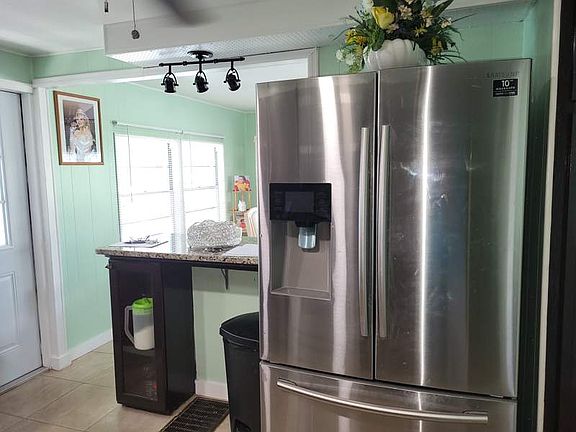
Identify the location of trash can. (242, 360).